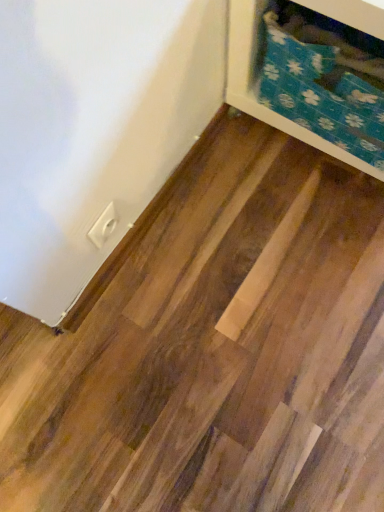
Measure the distance between point (93, 234) and camera.

31.46 inches.

Image resolution: width=384 pixels, height=512 pixels. Describe the element at coordinates (103, 226) in the screenshot. I see `white plastic outlet at lower left` at that location.

Locate an element on the screen. white plastic outlet at lower left is located at coordinates (103, 226).

Describe the element at coordinates (257, 85) in the screenshot. Image resolution: width=384 pixels, height=512 pixels. I see `blue floral fabric at upper right` at that location.

Find the location of `blue floral fabric at upper right`. blue floral fabric at upper right is located at coordinates (257, 85).

At what (x,y) coordinates should I click in order to perform the action: click on white plastic outlet at lower left. Please return your answer as a coordinate pair (x, y). This screenshot has width=384, height=512. Looking at the image, I should click on (103, 226).

Would you say white plastic outlet at lower left is to the left or to the right of blue floral fabric at upper right in the picture?

Based on their positions, white plastic outlet at lower left is located to the left of blue floral fabric at upper right.

Considering the positions of objects white plastic outlet at lower left and blue floral fabric at upper right in the image provided, who is behind, white plastic outlet at lower left or blue floral fabric at upper right?

white plastic outlet at lower left is further away from the camera.

Is point (103, 211) behind point (370, 174)?

No.

From the image's perspective, is white plastic outlet at lower left above blue floral fabric at upper right?

Actually, white plastic outlet at lower left appears below blue floral fabric at upper right in the image.

From a real-world perspective, which object stands above the other?

blue floral fabric at upper right is physically above.

Does white plastic outlet at lower left have a lesser width compared to blue floral fabric at upper right?

Correct, the width of white plastic outlet at lower left is less than that of blue floral fabric at upper right.

Is white plastic outlet at lower left shorter than blue floral fabric at upper right?

Correct, white plastic outlet at lower left is not as tall as blue floral fabric at upper right.

Looking at the image, does white plastic outlet at lower left seem bigger or smaller compared to blue floral fabric at upper right?

Clearly, white plastic outlet at lower left is smaller in size than blue floral fabric at upper right.

Is white plastic outlet at lower left inside the boundaries of blue floral fabric at upper right, or outside?

The correct answer is: outside.

Is white plastic outlet at lower left far away from blue floral fabric at upper right?

white plastic outlet at lower left is actually quite close to blue floral fabric at upper right.

Is white plastic outlet at lower left aimed at blue floral fabric at upper right?

No, white plastic outlet at lower left is not oriented towards blue floral fabric at upper right.

Where is `electric outlet that appears below the blue floral fabric at upper right (from a real-world perspective)`? This screenshot has height=512, width=384. electric outlet that appears below the blue floral fabric at upper right (from a real-world perspective) is located at coordinates (103, 226).

Can you confirm if blue floral fabric at upper right is positioned to the left of white plastic outlet at lower left?

No.

Does blue floral fabric at upper right lie in front of white plastic outlet at lower left?

Yes, it is.

Is point (245, 67) positioned before point (102, 240)?

No, (245, 67) is behind (102, 240).

From the image's perspective, which one is positioned higher, blue floral fabric at upper right or white plastic outlet at lower left?

blue floral fabric at upper right.

From a real-world perspective, who is located lower, blue floral fabric at upper right or white plastic outlet at lower left?

white plastic outlet at lower left, from a real-world perspective.

Does blue floral fabric at upper right have a lesser width compared to white plastic outlet at lower left?

No, blue floral fabric at upper right is not thinner than white plastic outlet at lower left.

Can you confirm if blue floral fabric at upper right is shorter than white plastic outlet at lower left?

No, blue floral fabric at upper right is not shorter than white plastic outlet at lower left.

Considering the relative sizes of blue floral fabric at upper right and white plastic outlet at lower left in the image provided, is blue floral fabric at upper right smaller than white plastic outlet at lower left?

No.

Do you think blue floral fabric at upper right is within white plastic outlet at lower left, or outside of it?

blue floral fabric at upper right is not enclosed by white plastic outlet at lower left.

Are blue floral fabric at upper right and white plastic outlet at lower left far apart?

No, blue floral fabric at upper right is not far from white plastic outlet at lower left.

Is blue floral fabric at upper right positioned with its back to white plastic outlet at lower left?

blue floral fabric at upper right does not have its back to white plastic outlet at lower left.

How different are the orientations of blue floral fabric at upper right and white plastic outlet at lower left in degrees?

There is a 93.9-degree angle between the facing directions of blue floral fabric at upper right and white plastic outlet at lower left.

How much distance is there between blue floral fabric at upper right and white plastic outlet at lower left?

blue floral fabric at upper right and white plastic outlet at lower left are 17.90 inches apart from each other.

I want to click on electric outlet below the blue floral fabric at upper right (from the image's perspective), so click(x=103, y=226).

This screenshot has height=512, width=384. I want to click on furniture above the white plastic outlet at lower left (from a real-world perspective), so click(x=257, y=85).

Find the location of a particular element. electric outlet lying behind the blue floral fabric at upper right is located at coordinates (103, 226).